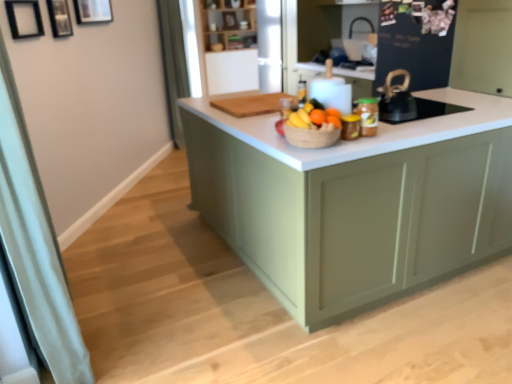
You are a GUI agent. You are given a task and a screenshot of the screen. Output one action in this format:
    pyautogui.click(x=<x>, y=<y>)
    Task: Click on the unoccupied area behind white fabric curtain at left, marked as the first curtain in a bottom-to-top arrangement
    This screenshot has width=512, height=384.
    Given the screenshot: What is the action you would take?
    pyautogui.click(x=110, y=264)